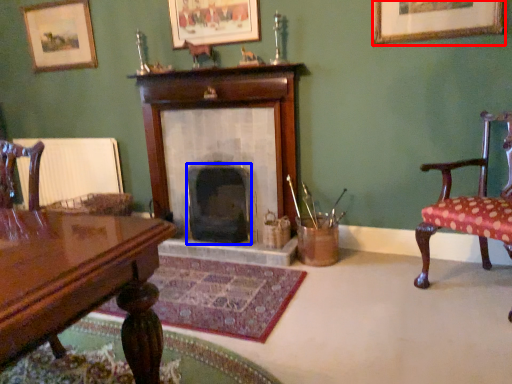
Question: Among these objects, which one is nearest to the camera, picture frame (highlighted by a red box) or fireplace (highlighted by a blue box)?

Choices:
 (A) picture frame
 (B) fireplace

Answer: (A)